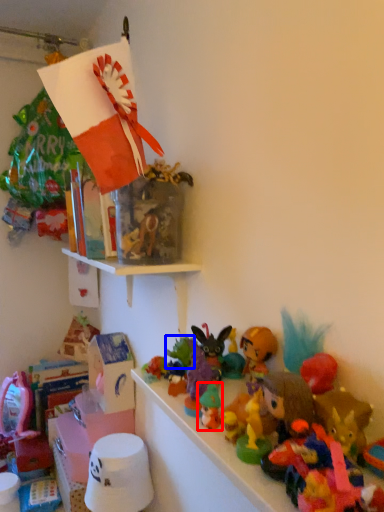
Question: Among these objects, which one is nearest to the camera, toy (highlighted by a red box) or toy (highlighted by a blue box)?

Choices:
 (A) toy
 (B) toy

Answer: (A)